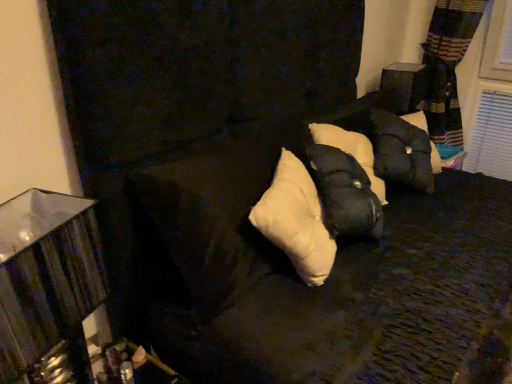
Where is `metallic striped lampshade at lower left`? Image resolution: width=512 pixels, height=384 pixels. metallic striped lampshade at lower left is located at coordinates (46, 275).

The image size is (512, 384). What do you see at coordinates (46, 275) in the screenshot?
I see `metallic striped lampshade at lower left` at bounding box center [46, 275].

Where is `metallic striped lampshade at lower left`? metallic striped lampshade at lower left is located at coordinates (46, 275).